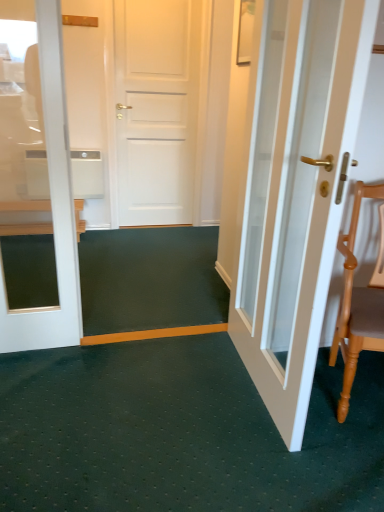
Question: In terms of height, does wooden chair at left look taller or shorter compared to white glossy door at right?

Choices:
 (A) short
 (B) tall

Answer: (A)

Question: Does point (77, 229) appear closer or farther from the camera than point (329, 245)?

Choices:
 (A) closer
 (B) farther

Answer: (B)

Question: Based on their relative distances, which object is nearer to the white glossy door at right?

Choices:
 (A) light brown wooden chair at right
 (B) wooden chair at left

Answer: (A)

Question: Estimate the real-world distances between objects in this image. Which object is closer to the wooden chair at left?

Choices:
 (A) white glossy door at right
 (B) light brown wooden chair at right

Answer: (A)